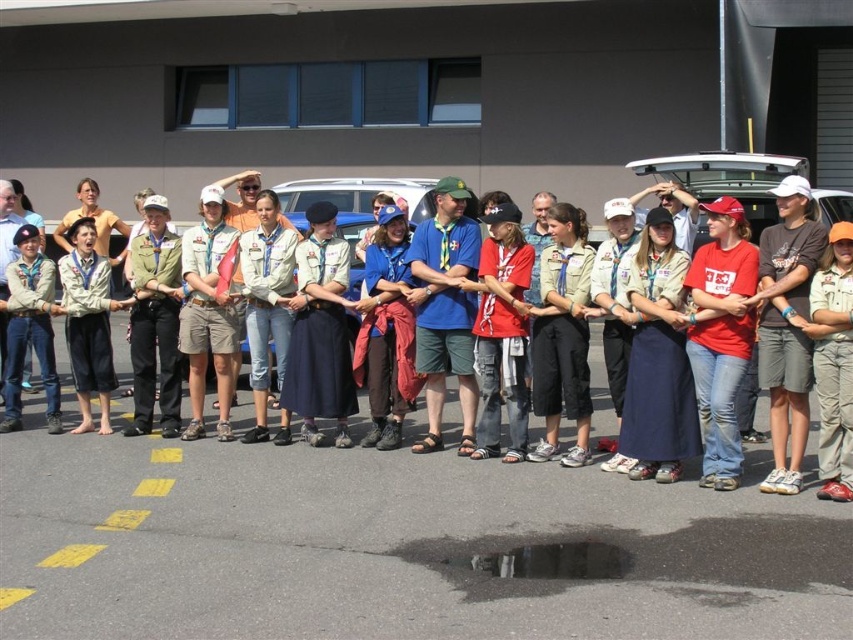
Question: Which point is closer to the camera taking this photo?

Choices:
 (A) (274, 348)
 (B) (830, 348)
 (C) (200, 355)

Answer: (B)

Question: Which point is farther to the camera?

Choices:
 (A) matte khaki shorts at center
 (B) navy blue skirt at center
 (C) blue fabric shirt at center

Answer: (C)

Question: Is blue fabric shirt at center closer to the viewer compared to blue fabric scarf at center?

Choices:
 (A) no
 (B) yes

Answer: (B)

Question: Based on their relative distances, which object is farther from the navy blue skirt at center?

Choices:
 (A) khaki shorts at center
 (B) khaki uniform at center

Answer: (A)

Question: Is matte khaki shorts at center to the right of satin khaki uniform at center from the viewer's perspective?

Choices:
 (A) no
 (B) yes

Answer: (B)

Question: Can you confirm if satin khaki uniform at center is bigger than khaki uniform at center?

Choices:
 (A) no
 (B) yes

Answer: (B)